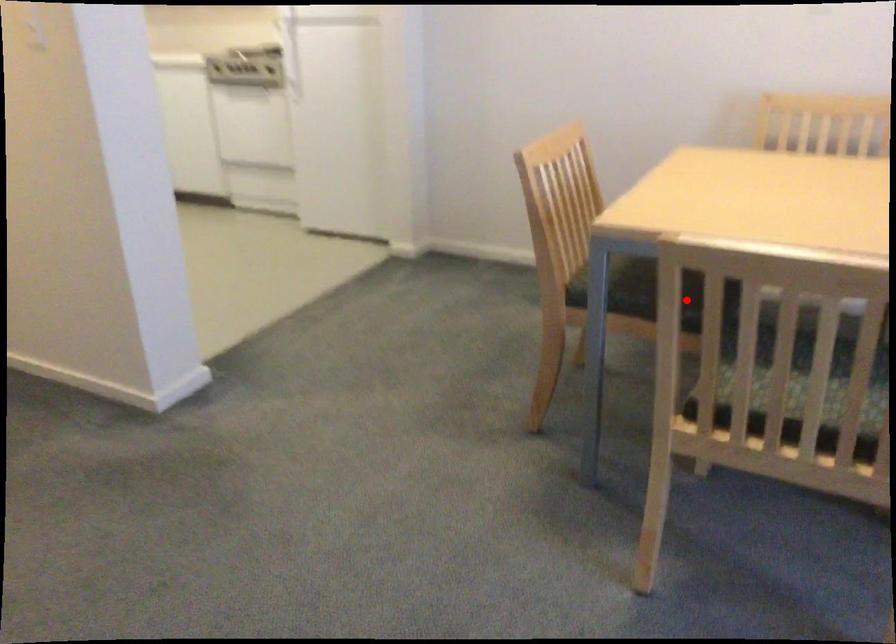
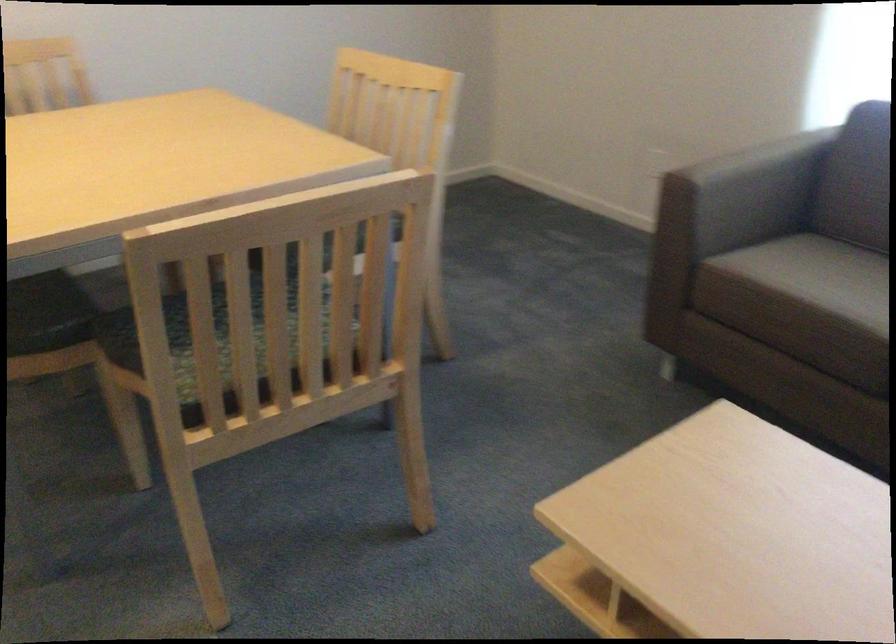
Question: I am providing you with two images of the same scene from different viewpoints. A red point is marked on the first image. At the location where the point appears in image 1, is it still visible in image 2?

Choices:
 (A) Yes
 (B) No

Answer: (A)